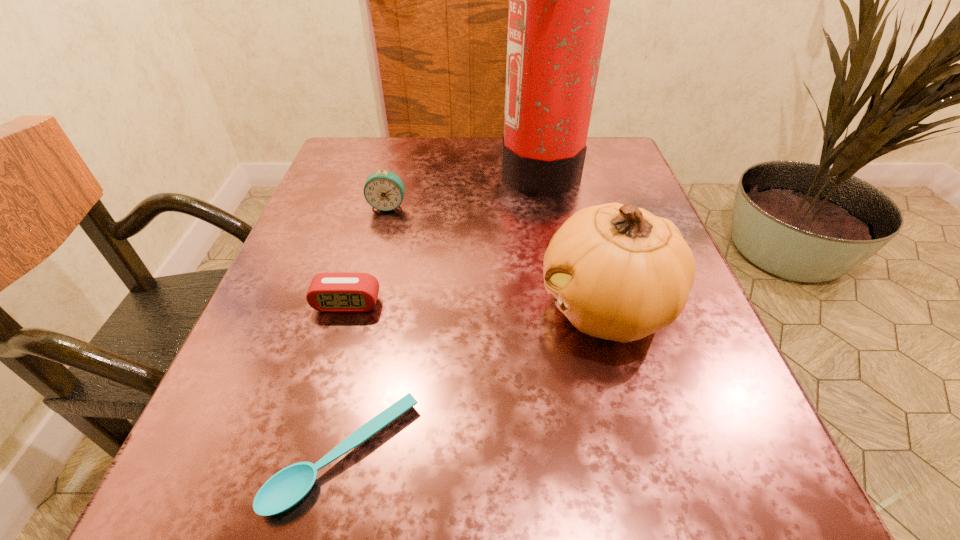
Locate an element on the screen. This screenshot has height=540, width=960. the tallest object is located at coordinates (559, 0).

Find the location of a particular element. This screenshot has width=960, height=540. the fourth shortest object is located at coordinates (617, 272).

Where is `the farther alarm clock`? Image resolution: width=960 pixels, height=540 pixels. the farther alarm clock is located at coordinates (384, 190).

Locate an element on the screen. This screenshot has width=960, height=540. the taller alarm clock is located at coordinates (384, 190).

At what (x,y) coordinates should I click in order to perform the action: click on the nearer alarm clock. Please return your answer as a coordinate pair (x, y). The height and width of the screenshot is (540, 960). Looking at the image, I should click on (341, 291).

Where is `the second shortest object`? The width and height of the screenshot is (960, 540). the second shortest object is located at coordinates (341, 291).

I want to click on spoon, so click(286, 488).

Find the location of a particular element. The width and height of the screenshot is (960, 540). the shortest object is located at coordinates click(x=286, y=488).

Where is `free region located 0.070m on the front side of the tallest object`? This screenshot has height=540, width=960. free region located 0.070m on the front side of the tallest object is located at coordinates [x=470, y=169].

In order to click on free space located on the front side of the tallest object in this screenshot , I will do `click(341, 169)`.